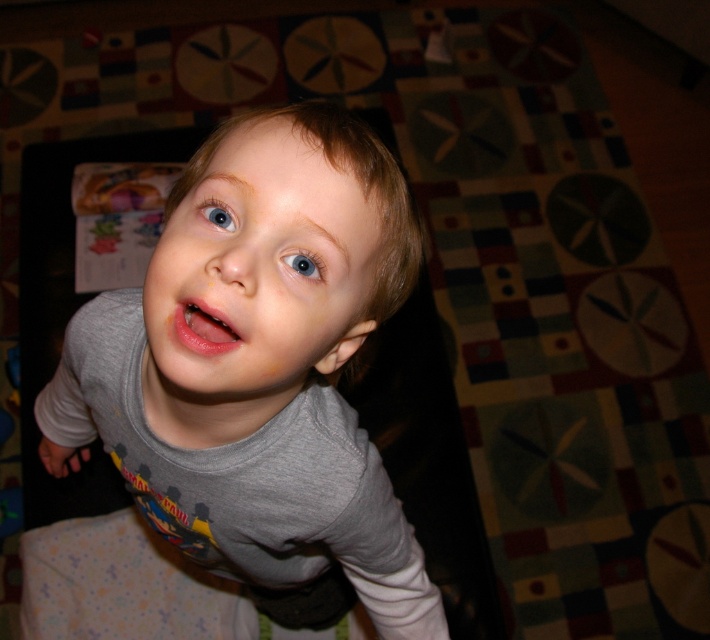
You are holding a small toy that you want to place exactly at the point marked as point (320, 266). Considering the scene described, can you estimate how far you need to move forward from your current position to reach that point?

The point (320, 266) is 17.23 inches away from the viewer, so you need to move forward approximately 17.23 inches to reach that point.

You are a photographer trying to capture the child in the image. Since the smooth gray shirt at center and the blue glossy eye at upper center are both in the frame, which one is positioned higher up in the image?

The smooth gray shirt at center is taller than the blue glossy eye at upper center, so the smooth gray shirt at center is positioned higher up in the image.